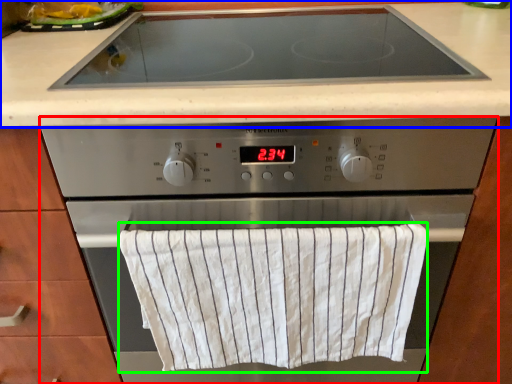
Question: Estimate the real-world distances between objects in this image. Which object is closer to home appliance (highlighted by a red box), countertop (highlighted by a blue box) or bath towel (highlighted by a green box)?

Choices:
 (A) countertop
 (B) bath towel

Answer: (B)